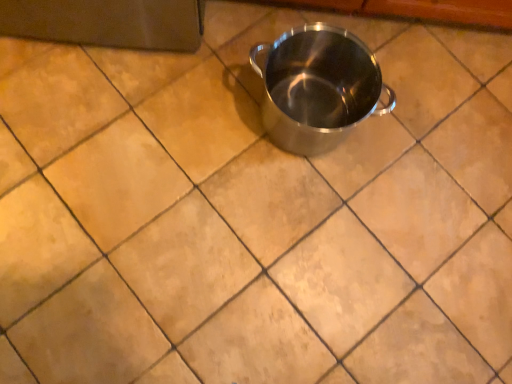
At what (x,y) coordinates should I click in order to perform the action: click on vacant space positioned to the left of shiny metallic pot at center. Please return your answer as a coordinate pair (x, y). The image size is (512, 384). Looking at the image, I should click on point(199,95).